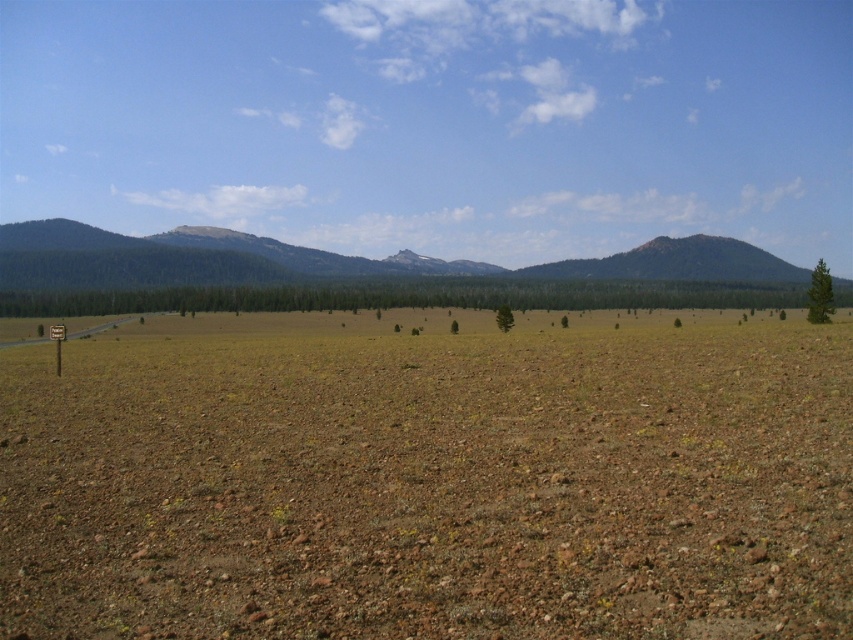
From the picture: You are an environmental scientist analyzing the landscape. You observe the brown gravelly dirt field at center and the green textured tree at right. Which area covers a smaller portion of the image?

The brown gravelly dirt field at center occupies less space than the green textured tree at right, so the brown gravelly dirt field at center covers a smaller portion of the image.

You are planning to plant a new tree in this landscape. The green matte tree at center and the green textured tree at center are already present. Which tree has a wider canopy to provide more shade?

The green matte tree at center has a wider canopy than the green textured tree at center, so it provides more shade.

You are standing at the point labeled point (815, 305) and want to walk to the distant mountains visible in the background. Which direction should you move relative to the point labeled point (506, 305)?

Since point (815, 305) is closer to the viewer than point (506, 305), you should move away from point (506, 305) to reach the distant mountains.